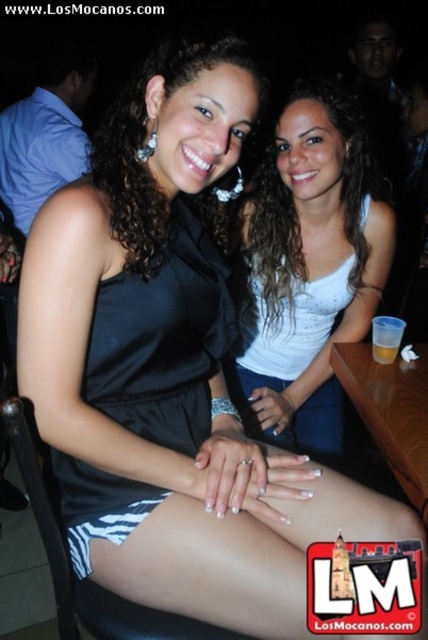
You are a photographer setting up a camera to capture both the white glittery tank top at center and the black satin dress at center in the same frame. Based on their positions, which clothing item is wider?

The white glittery tank top at center might be wider than black satin dress at center according to the description.

You are a photographer at a fashion show and need to ensure that the white glittery tank top at center and the black satin dress at center are visible in your photo. Based on their heights, which one is more likely to be seen by the camera positioned at eye level?

The white glittery tank top at center is taller than the black satin dress at center, so it is more likely to be seen by the camera positioned at eye level.

You are a photographer at a fashion show and need to capture both the white glittery tank top at center and the black satin dress at center in a single shot. Which one will appear closer to the camera in the photo?

The white glittery tank top at center will appear closer to the camera because it is further to the viewer than the black satin dress at center.